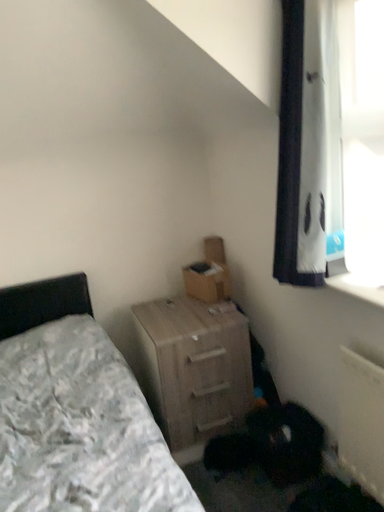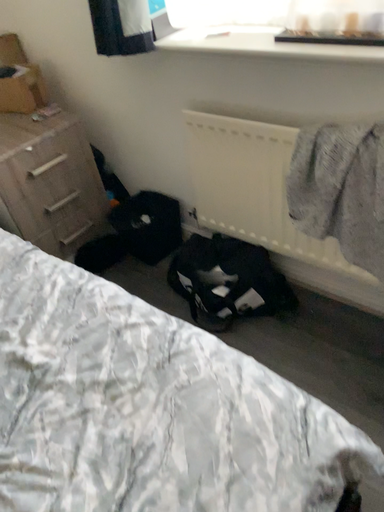
Question: How did the camera likely rotate when shooting the video?

Choices:
 (A) rotated upward
 (B) rotated downward

Answer: (B)